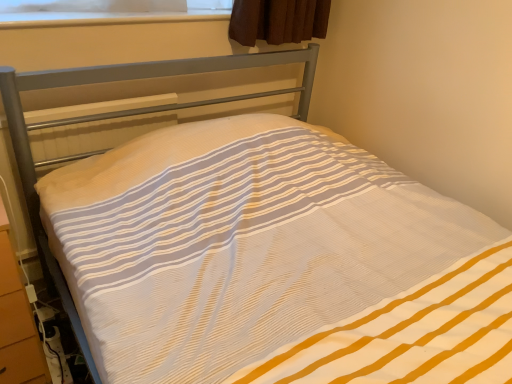
Describe the element at coordinates (102, 12) in the screenshot. This screenshot has height=384, width=512. I see `transparent plastic at upper center` at that location.

At what (x,y) coordinates should I click in order to perform the action: click on transparent plastic at upper center. Please return your answer as a coordinate pair (x, y). Image resolution: width=512 pixels, height=384 pixels. Looking at the image, I should click on (102, 12).

What do you see at coordinates (17, 320) in the screenshot?
I see `orange wood dresser at lower left` at bounding box center [17, 320].

Where is `orange wood dresser at lower left`? The width and height of the screenshot is (512, 384). orange wood dresser at lower left is located at coordinates (17, 320).

Locate an element on the screen. The width and height of the screenshot is (512, 384). transparent plastic at upper center is located at coordinates pyautogui.click(x=102, y=12).

Is orange wood dresser at lower left to the right of transparent plastic at upper center from the viewer's perspective?

No, orange wood dresser at lower left is not to the right of transparent plastic at upper center.

Is the depth of orange wood dresser at lower left less than that of transparent plastic at upper center?

Yes, it is.

Which point is more forward, [16,274] or [36,26]?

A: The point [16,274] is in front.

From the image's perspective, is orange wood dresser at lower left positioned above or below transparent plastic at upper center?

From the image's perspective, orange wood dresser at lower left appears below transparent plastic at upper center.

From a real-world perspective, which object stands above the other?

transparent plastic at upper center, from a real-world perspective.

Considering the relative sizes of orange wood dresser at lower left and transparent plastic at upper center in the image provided, is orange wood dresser at lower left thinner than transparent plastic at upper center?

No.

Considering the sizes of objects orange wood dresser at lower left and transparent plastic at upper center in the image provided, who is shorter, orange wood dresser at lower left or transparent plastic at upper center?

transparent plastic at upper center is shorter.

Does orange wood dresser at lower left have a larger size compared to transparent plastic at upper center?

Indeed, orange wood dresser at lower left has a larger size compared to transparent plastic at upper center.

Is orange wood dresser at lower left outside of transparent plastic at upper center?

Absolutely, orange wood dresser at lower left is external to transparent plastic at upper center.

Is orange wood dresser at lower left with transparent plastic at upper center?

No, orange wood dresser at lower left is not with transparent plastic at upper center.

Is orange wood dresser at lower left aimed at transparent plastic at upper center?

No, orange wood dresser at lower left is not oriented towards transparent plastic at upper center.

What's the angular difference between orange wood dresser at lower left and transparent plastic at upper center's facing directions?

1.08 degrees separate the facing orientations of orange wood dresser at lower left and transparent plastic at upper center.

How much distance is there between orange wood dresser at lower left and transparent plastic at upper center?

A distance of 34.89 inches exists between orange wood dresser at lower left and transparent plastic at upper center.

The width and height of the screenshot is (512, 384). Find the location of `window screen on the right of orange wood dresser at lower left`. window screen on the right of orange wood dresser at lower left is located at coordinates (102, 12).

In the image, is transparent plastic at upper center on the left side or the right side of orange wood dresser at lower left?

Based on their positions, transparent plastic at upper center is located to the right of orange wood dresser at lower left.

Based on the photo, is the depth of transparent plastic at upper center greater than that of orange wood dresser at lower left?

Yes, transparent plastic at upper center is further from the camera.

Is point (86, 19) behind point (34, 324)?

Yes, it is behind point (34, 324).

From the image's perspective, which one is positioned lower, transparent plastic at upper center or orange wood dresser at lower left?

orange wood dresser at lower left is shown below in the image.

From a real-world perspective, relative to orange wood dresser at lower left, is transparent plastic at upper center vertically above or below?

In terms of real-world spatial position, transparent plastic at upper center is above orange wood dresser at lower left.

Consider the image. Which of these two, transparent plastic at upper center or orange wood dresser at lower left, is wider?

With larger width is orange wood dresser at lower left.

Considering the relative sizes of transparent plastic at upper center and orange wood dresser at lower left in the image provided, is transparent plastic at upper center shorter than orange wood dresser at lower left?

Yes.

Considering the sizes of transparent plastic at upper center and orange wood dresser at lower left in the image, is transparent plastic at upper center bigger or smaller than orange wood dresser at lower left?

Considering their sizes, transparent plastic at upper center takes up less space than orange wood dresser at lower left.

Would you say orange wood dresser at lower left is part of transparent plastic at upper center's contents?

Definitely not — orange wood dresser at lower left is not inside transparent plastic at upper center.

Can you see transparent plastic at upper center touching orange wood dresser at lower left?

No.

Consider the image. Is orange wood dresser at lower left at the back of transparent plastic at upper center?

That's not correct — transparent plastic at upper center is not looking away from orange wood dresser at lower left.

Can you tell me how much transparent plastic at upper center and orange wood dresser at lower left differ in facing direction?

They differ by 1.08 degrees in their facing directions.

Identify the location of dresser that appears below the transparent plastic at upper center (from the image's perspective). The height and width of the screenshot is (384, 512). (17, 320).

Image resolution: width=512 pixels, height=384 pixels. Identify the location of dresser below the transparent plastic at upper center (from the image's perspective). (17, 320).

The image size is (512, 384). Find the location of `window screen behind the orange wood dresser at lower left`. window screen behind the orange wood dresser at lower left is located at coordinates (102, 12).